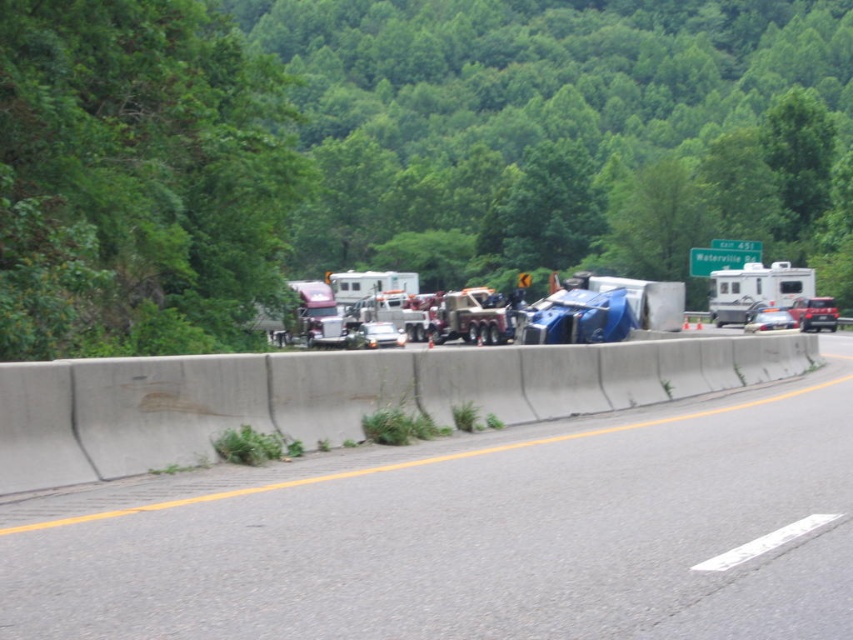
Question: Among these objects, which one is nearest to the camera?

Choices:
 (A) gray concrete barrier at center
 (B) white glossy rv at center
 (C) metallic silver sedan at center

Answer: (A)

Question: Which of these objects is positioned closest to the metallic silver suv at center?

Choices:
 (A) white glossy rv at center
 (B) metallic blue sedan at center
 (C) metallic silver sedan at center

Answer: (B)

Question: Is metallic silver suv at center positioned at the back of metallic blue sedan at center?

Choices:
 (A) no
 (B) yes

Answer: (B)

Question: Is white glossy rv at center below metallic blue sedan at center?

Choices:
 (A) no
 (B) yes

Answer: (A)

Question: Does white glossy rv at center appear on the right side of metallic silver sedan at center?

Choices:
 (A) no
 (B) yes

Answer: (B)

Question: Which of the following is the farthest from the observer?

Choices:
 (A) metallic silver suv at center
 (B) metallic silver sedan at center

Answer: (A)